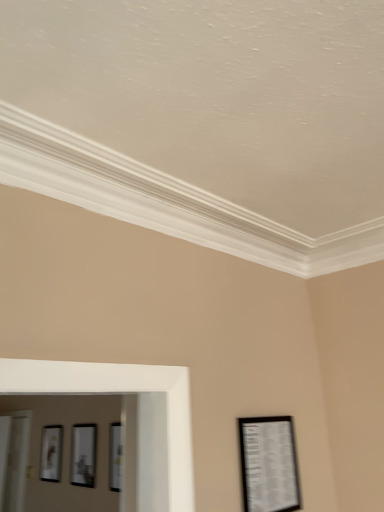
Question: Considering the relative sizes of matte black picture frame at center, the second picture frame from the front, and matte black picture frame at left, the 1th picture frame in the bottom-to-top sequence, in the image provided, is matte black picture frame at center, the second picture frame from the front, shorter than matte black picture frame at left, the 1th picture frame in the bottom-to-top sequence,?

Choices:
 (A) yes
 (B) no

Answer: (A)

Question: From a real-world perspective, is matte black picture frame at center, the second picture frame viewed from the top, physically above matte black picture frame at left, the 3th picture frame from the top?

Choices:
 (A) no
 (B) yes

Answer: (A)

Question: Is matte black picture frame at center, placed as the 2th picture frame when sorted from left to right, positioned before matte black picture frame at left, the 3th picture frame from the top?

Choices:
 (A) no
 (B) yes

Answer: (B)

Question: Is matte black picture frame at center, the second picture frame viewed from the top, further to the viewer compared to matte black picture frame at left, the 3th picture frame positioned from the right?

Choices:
 (A) yes
 (B) no

Answer: (B)

Question: Does matte black picture frame at center, placed as the 2th picture frame when sorted from left to right, have a lesser width compared to matte black picture frame at left, arranged as the 3th picture frame when viewed from the front?

Choices:
 (A) no
 (B) yes

Answer: (A)

Question: From a real-world perspective, is matte black picture frame at center, the second picture frame from the front, above or below matte black picture frame at lower right, the 3th picture frame ordered from the bottom?

Choices:
 (A) below
 (B) above

Answer: (A)

Question: Is matte black picture frame at center, positioned as the second picture frame in right-to-left order, spatially inside matte black picture frame at lower right, which is the first picture frame from front to back, or outside of it?

Choices:
 (A) inside
 (B) outside

Answer: (B)

Question: In the image, is matte black picture frame at center, the second picture frame viewed from the top, on the left side or the right side of matte black picture frame at lower right, which is the third picture frame in left-to-right order?

Choices:
 (A) left
 (B) right

Answer: (A)

Question: From the image's perspective, is matte black picture frame at center, the second picture frame viewed from the top, positioned above or below matte black picture frame at lower right, which is the third picture frame in left-to-right order?

Choices:
 (A) above
 (B) below

Answer: (B)

Question: From the image's perspective, is matte black picture frame at left, the first picture frame from the left, above or below matte black picture frame at center, which ranks as the second picture frame in back-to-front order?

Choices:
 (A) above
 (B) below

Answer: (B)

Question: From a real-world perspective, is matte black picture frame at left, the 3th picture frame from the top, physically located above or below matte black picture frame at center, the second picture frame from the front?

Choices:
 (A) below
 (B) above

Answer: (B)

Question: In terms of width, does matte black picture frame at left, the 3th picture frame positioned from the right, look wider or thinner when compared to matte black picture frame at center, the second picture frame viewed from the top?

Choices:
 (A) wide
 (B) thin

Answer: (B)

Question: Is point (52, 433) closer or farther from the camera than point (86, 434)?

Choices:
 (A) closer
 (B) farther

Answer: (B)

Question: Considering the relative positions of matte black picture frame at lower right, marked as the 1th picture frame in a top-to-bottom arrangement, and matte black picture frame at center, the second picture frame viewed from the top, in the image provided, is matte black picture frame at lower right, marked as the 1th picture frame in a top-to-bottom arrangement, to the left or to the right of matte black picture frame at center, the second picture frame viewed from the top,?

Choices:
 (A) left
 (B) right

Answer: (B)

Question: Is matte black picture frame at lower right, the first picture frame viewed from the right, situated inside matte black picture frame at center, placed as the 2th picture frame when sorted from left to right, or outside?

Choices:
 (A) inside
 (B) outside

Answer: (B)